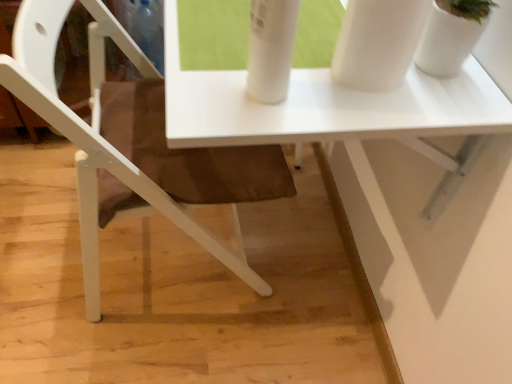
In order to click on free point below white matte chair at lower left (from a real-world perspective) in this screenshot , I will do `click(165, 259)`.